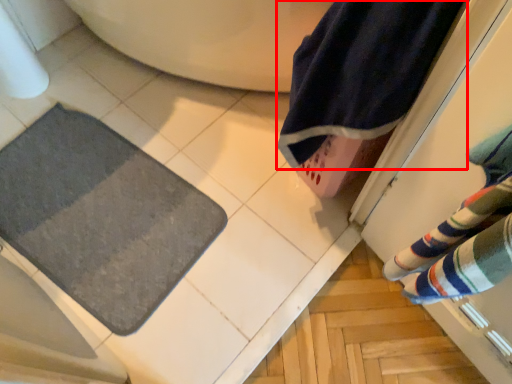
Question: Observing the image, what is the correct spatial positioning of beach towel (annotated by the red box) in reference to bath mat?

Choices:
 (A) right
 (B) left

Answer: (A)